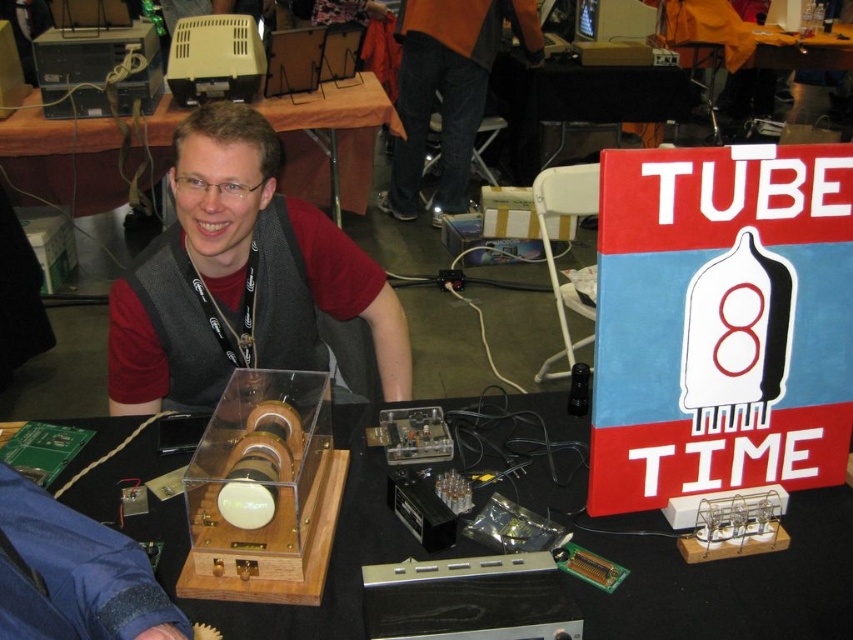
You are standing in front of the table at the tech event. You want to pick up an item from the transparent plastic table at center and then move to the black plastic table at center. Which table should you approach first?

You should approach the transparent plastic table at center first because it is closer to you than the black plastic table at center.